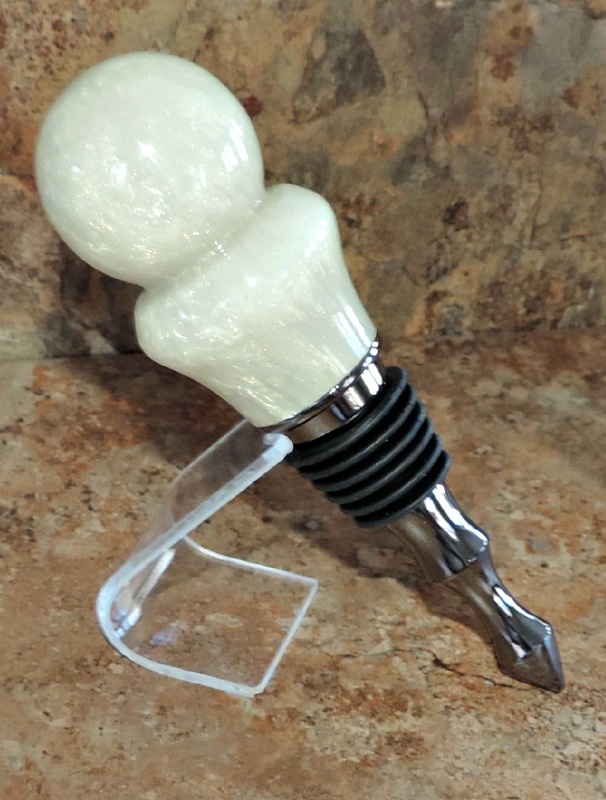
The image size is (606, 800). I want to click on plastic stand, so click(248, 613).